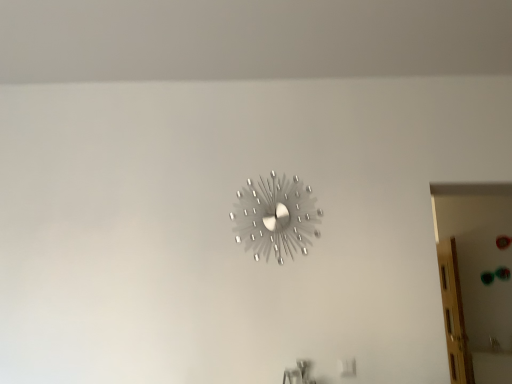
Question: From a real-world perspective, is translucent wood door at right above or below metallic silver wall clock at center?

Choices:
 (A) below
 (B) above

Answer: (A)

Question: Which is correct: translucent wood door at right is inside metallic silver wall clock at center, or outside of it?

Choices:
 (A) outside
 (B) inside

Answer: (A)

Question: Relative to metallic silver wall clock at center, is translucent wood door at right in front or behind?

Choices:
 (A) behind
 (B) front

Answer: (A)

Question: Based on their sizes in the image, would you say metallic silver wall clock at center is bigger or smaller than translucent wood door at right?

Choices:
 (A) small
 (B) big

Answer: (A)

Question: From a real-world perspective, is metallic silver wall clock at center positioned above or below translucent wood door at right?

Choices:
 (A) below
 (B) above

Answer: (B)

Question: Is metallic silver wall clock at center in front of or behind translucent wood door at right in the image?

Choices:
 (A) front
 (B) behind

Answer: (A)

Question: Considering the positions of point (253, 228) and point (454, 359), is point (253, 228) closer or farther from the camera than point (454, 359)?

Choices:
 (A) closer
 (B) farther

Answer: (A)